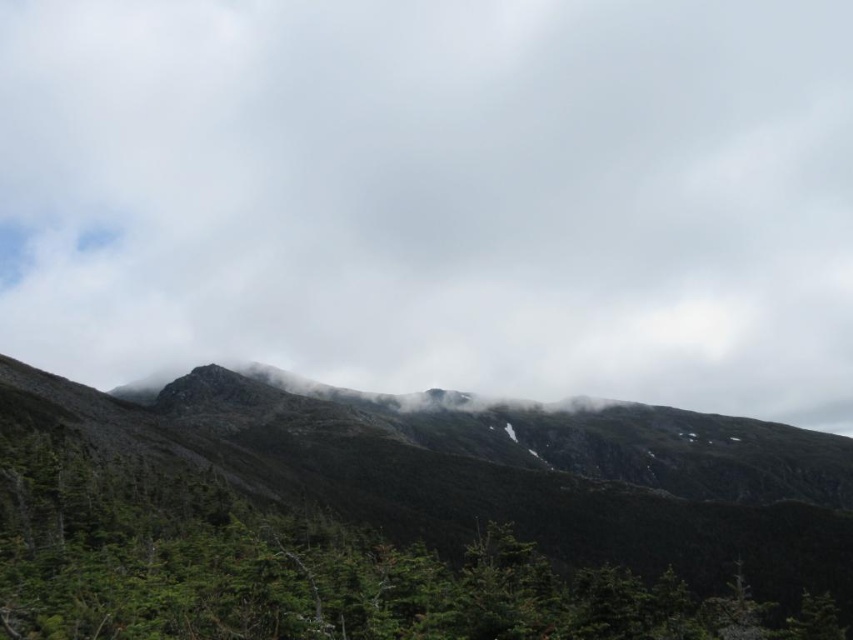
Question: Can you confirm if white fluffy cloud at upper center is positioned above green matte tree at center?

Choices:
 (A) yes
 (B) no

Answer: (A)

Question: Considering the relative positions of white fluffy cloud at upper center and green matte tree at center in the image provided, where is white fluffy cloud at upper center located with respect to green matte tree at center?

Choices:
 (A) above
 (B) below

Answer: (A)

Question: Is white fluffy cloud at upper center below green matte tree at center?

Choices:
 (A) no
 (B) yes

Answer: (A)